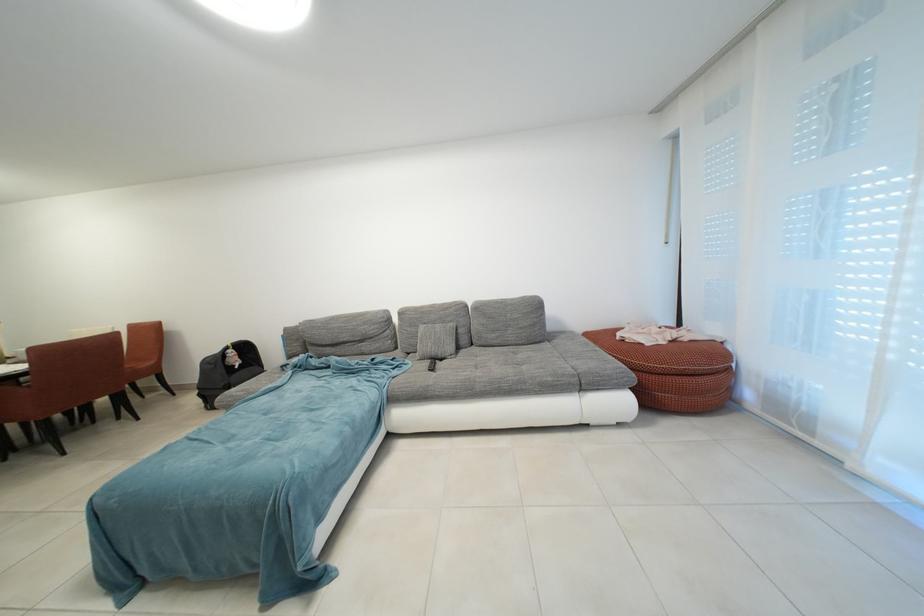
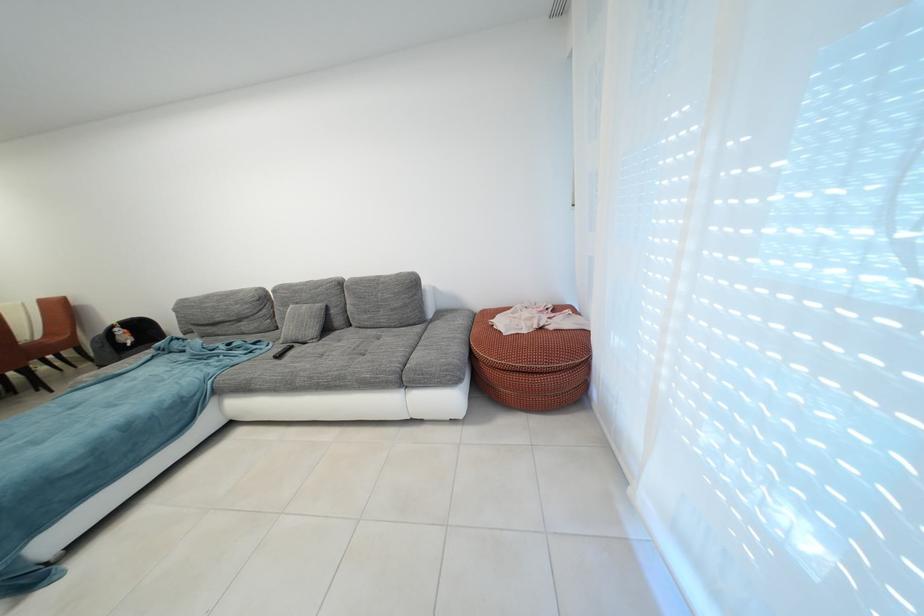
Locate, in the second image, the point that corresponds to point 441,373 in the first image.

(287, 361)